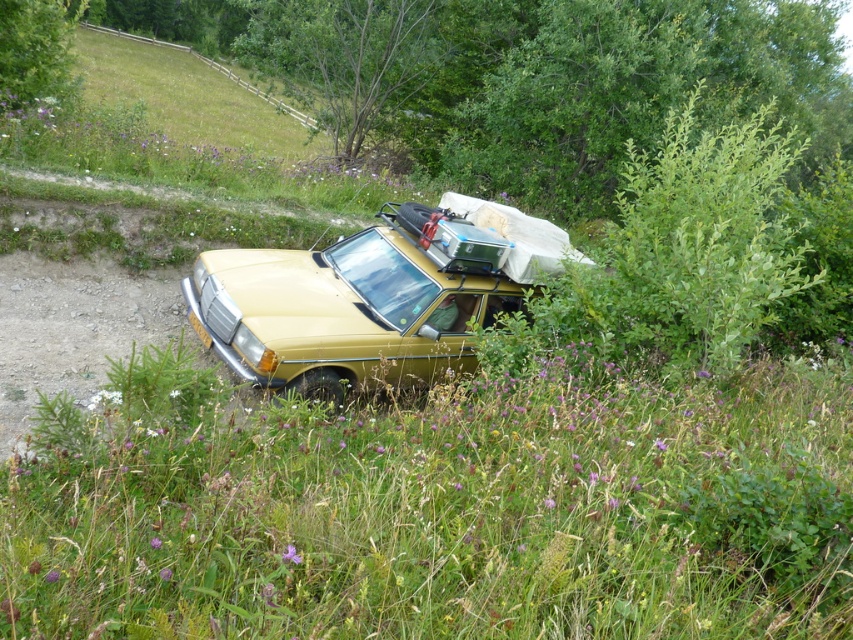
From the picture: You are standing at the point marked as point (438, 508) in the image. What is the color of the ground beneath your feet?

The point (438, 508) corresponds to green grass at center, so the ground beneath your feet is green.

You are a hiker who wants to walk from the green grass at center to the matte gold car at center. Based on the scene description, which direction should you move to reach the car?

Since the green grass at center is in front of the matte gold car at center, you should move backward to reach the matte gold car at center from the green grass at center.

In the scene shown: You are a hiker trying to cross the area where the green grass at center and matte gold car at center are located. Can you walk through the area between them without stepping on the car?

The green grass at center has a larger width than the matte gold car at center, so yes, you can walk through the area between them without stepping on the car.